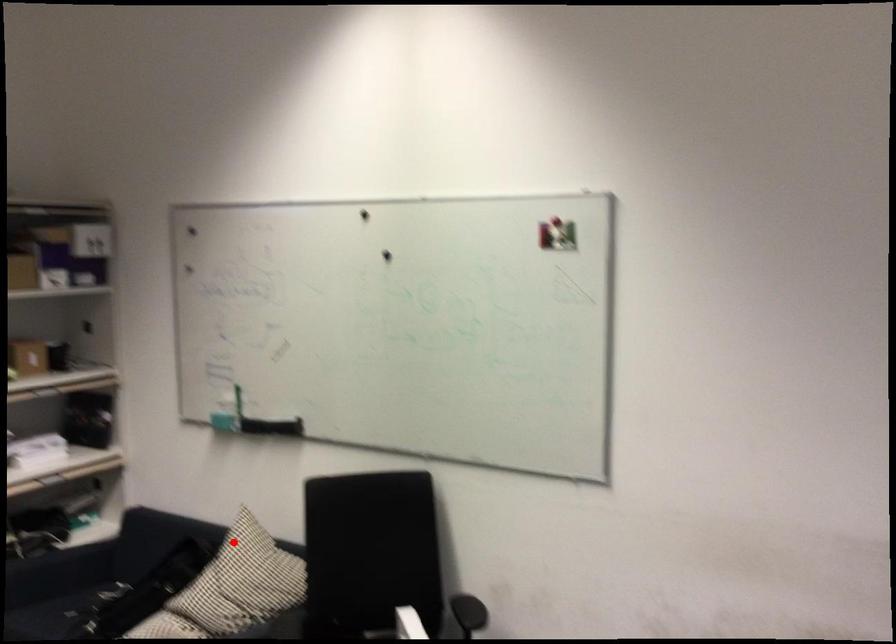
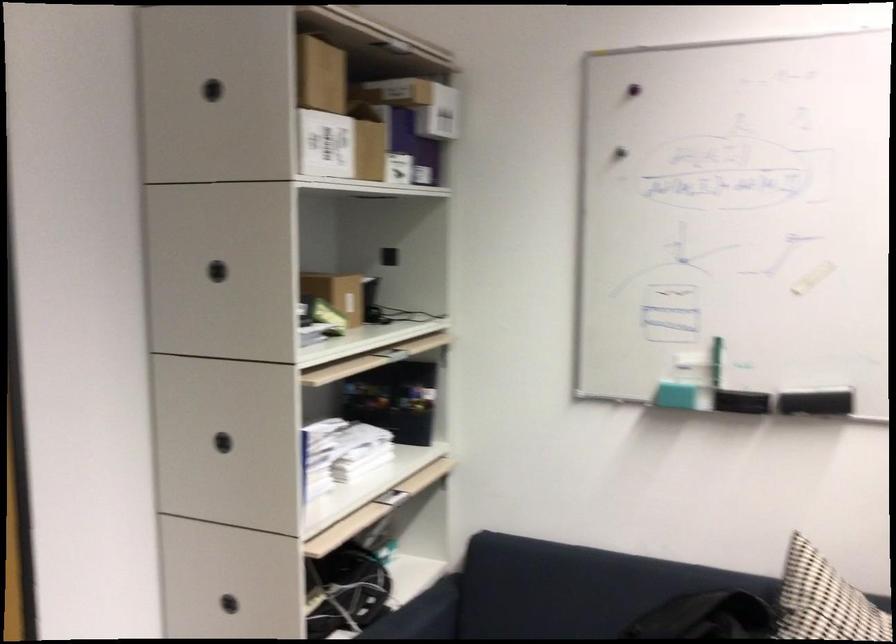
In the second image, find the point that corresponds to the highlighted location in the first image.

(823, 601)